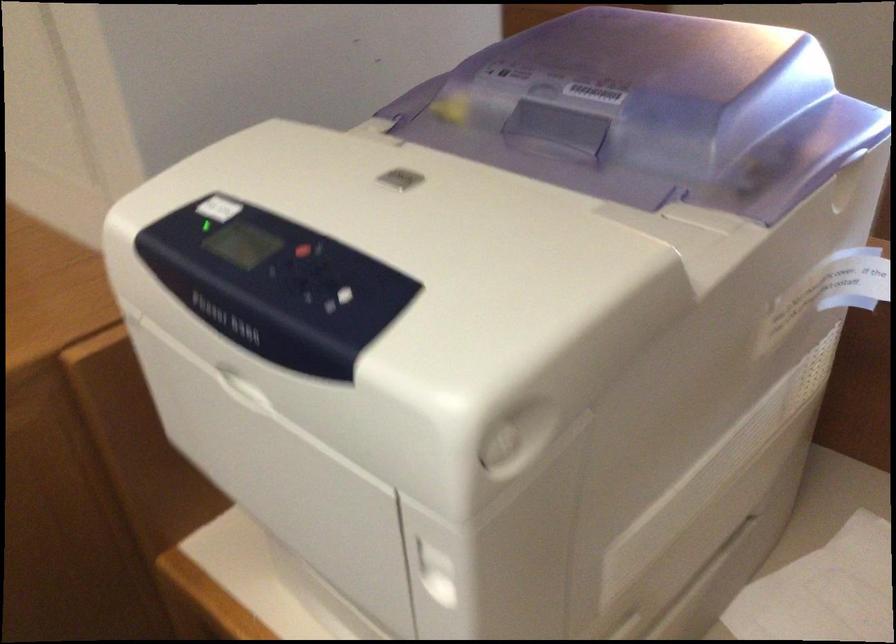
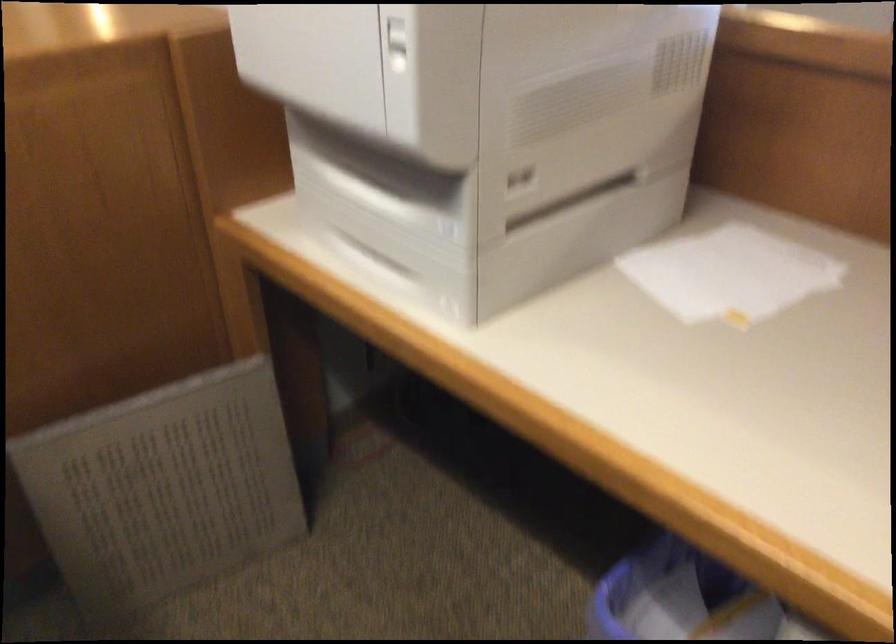
Where in the second image is the point corresponding to (438,569) from the first image?

(397, 44)